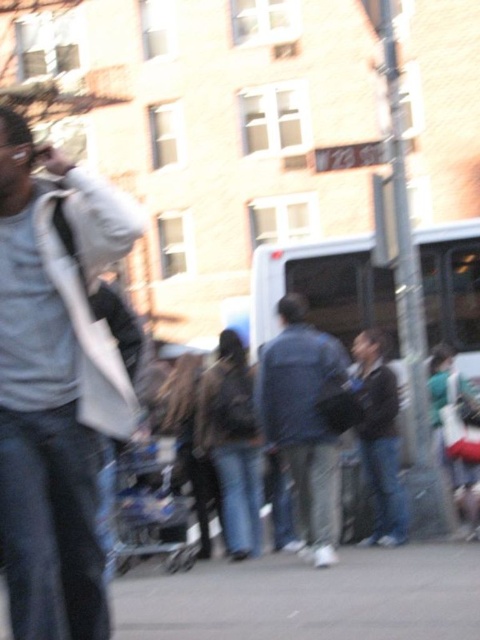
You are standing on the bustling urban street scene and want to reach the point at coordinates point (464,588) and point (285,461). Which point is closer to you?

Point (464,588) is closer to the viewer than point (285,461).

Consider the image. You are a delivery person who needs to place a white fabric bag at left onto the gray asphalt pavement at lower center. Based on the scene, will the bag fit entirely on the pavement without overlapping its edges?

The white fabric bag at left has a greater height compared to gray asphalt pavement at lower center. Since the bag is taller than the pavement, it might not fit entirely without overlapping the edges.